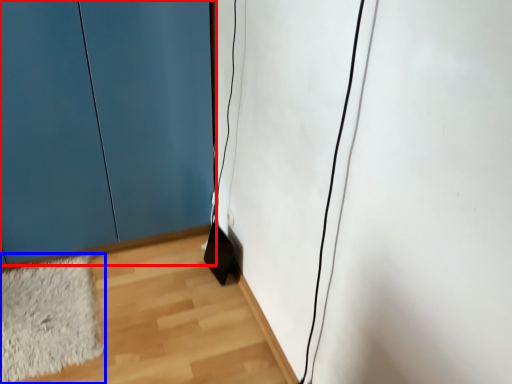
Question: Which point is closer to the camera, door (highlighted by a red box) or mat (highlighted by a blue box)?

Choices:
 (A) door
 (B) mat

Answer: (A)